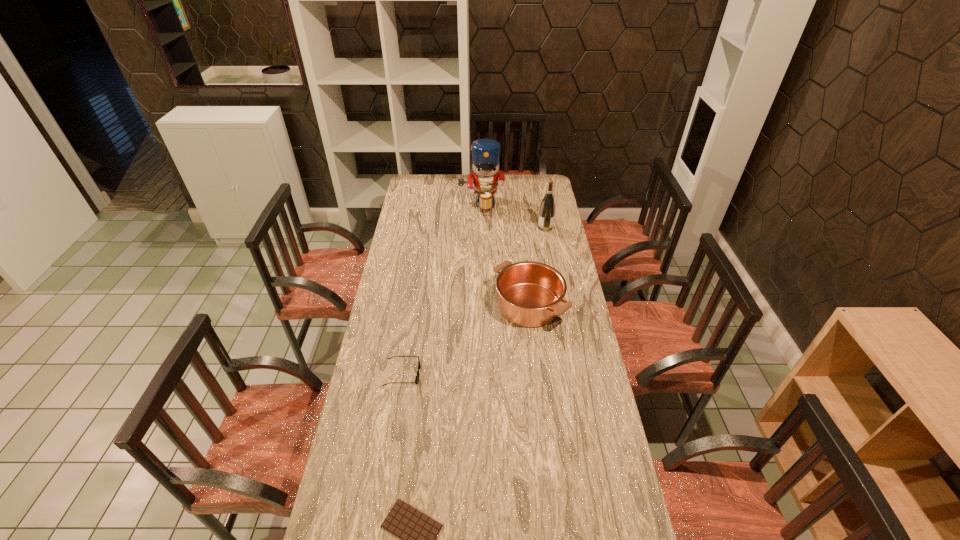
At what (x,y) coordinates should I click in order to perform the action: click on nutcracker. Please return your answer as a coordinate pair (x, y). The width and height of the screenshot is (960, 540). Looking at the image, I should click on (485, 153).

Identify the location of the farthest object. (485, 153).

At what (x,y) coordinates should I click in order to perform the action: click on the second farthest object. Please return your answer as a coordinate pair (x, y). This screenshot has height=540, width=960. Looking at the image, I should click on (547, 208).

This screenshot has width=960, height=540. I want to click on wine bottle, so click(547, 208).

Where is `saucepan`? The width and height of the screenshot is (960, 540). saucepan is located at coordinates (530, 294).

At what (x,y) coordinates should I click in order to perform the action: click on the third tallest object. Please return your answer as a coordinate pair (x, y). Image resolution: width=960 pixels, height=540 pixels. Looking at the image, I should click on (530, 294).

I want to click on spectacles, so click(x=417, y=376).

What are the coordinates of `the second shortest object` in the screenshot? It's located at (417, 376).

The width and height of the screenshot is (960, 540). Identify the location of free spot located 0.120m on the front-facing side of the nutcracker. (481, 227).

Image resolution: width=960 pixels, height=540 pixels. I want to click on vacant space located 0.280m on the label of the wine bottle, so click(485, 228).